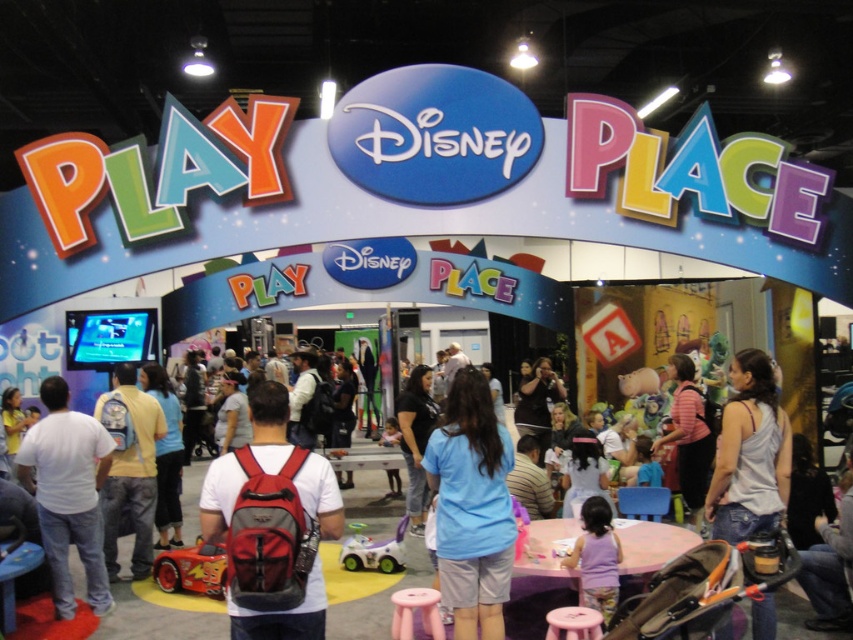
Question: Is denim jacket at center thinner than striped shirt at center?

Choices:
 (A) yes
 (B) no

Answer: (A)

Question: Estimate the real-world distances between objects in this image. Which object is farther from the red mesh backpack at center?

Choices:
 (A) blue cotton shirt at center
 (B) shiny red plastic car at center

Answer: (B)

Question: Which object appears closest to the camera in this image?

Choices:
 (A) purple fabric dress at center
 (B) blue cotton shirt at center

Answer: (B)

Question: Which object is the closest to the shiny red plastic car at center?

Choices:
 (A) denim jacket at center
 (B) blue cotton shirt at center

Answer: (A)

Question: From the image, what is the correct spatial relationship of blue cotton shirt at center in relation to white cotton shirt at center?

Choices:
 (A) above
 (B) below

Answer: (A)

Question: Observing the image, what is the correct spatial positioning of blue cotton shirt at center in reference to white matte shirt at lower left?

Choices:
 (A) right
 (B) left

Answer: (A)